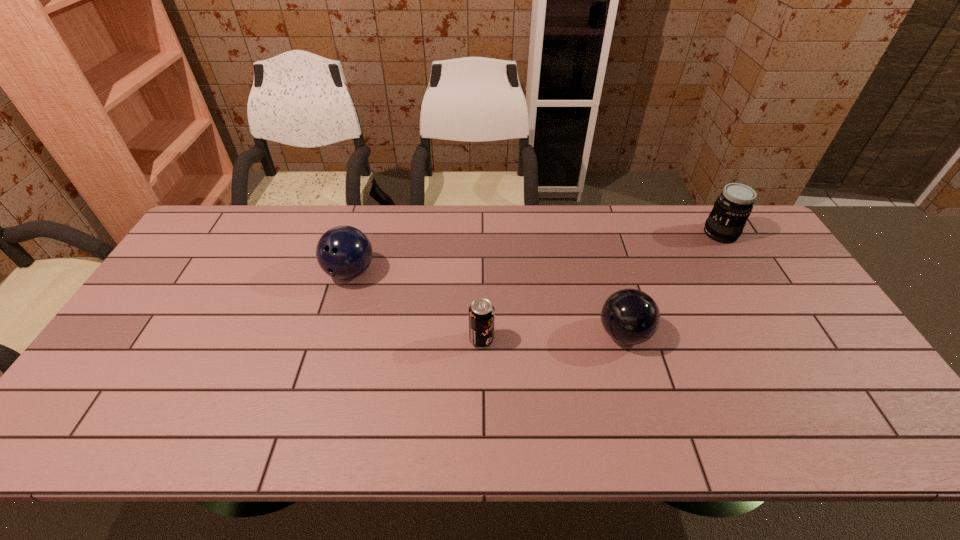
Point out which object is positioned as the third nearest to the farthest object. Please provide its 2D coordinates. Your answer should be formatted as a tuple, i.e. [(x, y)], where the tuple contains the x and y coordinates of a point satisfying the conditions above.

[(344, 252)]

The width and height of the screenshot is (960, 540). In order to click on object that is the second nearest to the soda can in this screenshot , I will do `click(344, 252)`.

I want to click on free spot that satisfies the following two spatial constraints: 1. on the front side of the telephoto lens; 2. on the side of the third object from left to right with the finger holes, so (x=781, y=334).